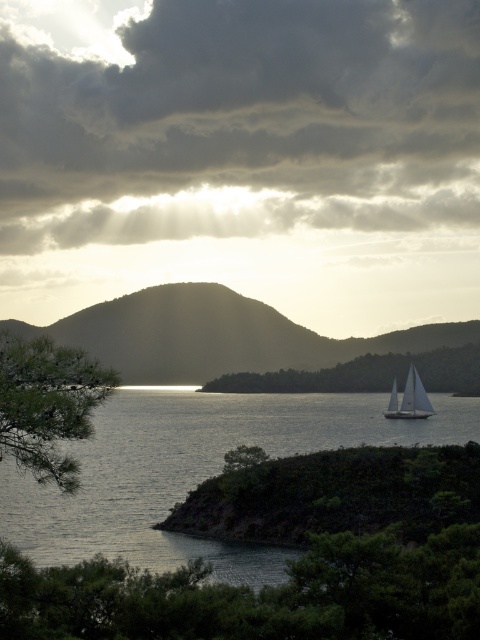
Question: Which point appears farthest from the camera in this image?

Choices:
 (A) (420, 387)
 (B) (0, 355)
 (C) (80, 236)

Answer: (C)

Question: Which object is closer to the camera taking this photo?

Choices:
 (A) green matte tree at center
 (B) green matte tree at lower left
 (C) white sailboat at lower right
 (D) clear water at center

Answer: (B)

Question: Is cloudy sky at upper center thinner than white sailboat at lower right?

Choices:
 (A) no
 (B) yes

Answer: (A)

Question: Does green matte tree at lower left appear on the right side of white sailboat at lower right?

Choices:
 (A) yes
 (B) no

Answer: (B)

Question: In this image, where is green matte tree at center located relative to white sailboat at lower right?

Choices:
 (A) below
 (B) above

Answer: (A)

Question: Among these points, which one is nearest to the camera?

Choices:
 (A) (93, 432)
 (B) (417, 401)

Answer: (A)